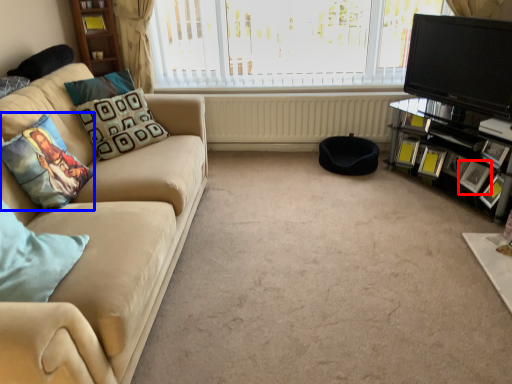
Question: Which point is further to the camera, picture frame (highlighted by a red box) or pillow (highlighted by a blue box)?

Choices:
 (A) picture frame
 (B) pillow

Answer: (A)